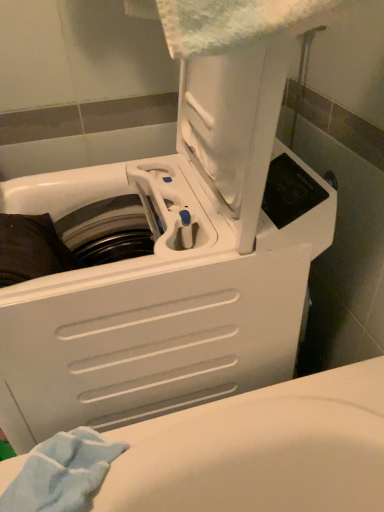
Question: From the image's perspective, is light blue soft towel at lower left located above or below white plastic washing machine at center?

Choices:
 (A) above
 (B) below

Answer: (B)

Question: Is light blue soft towel at lower left bigger or smaller than white plastic washing machine at center?

Choices:
 (A) small
 (B) big

Answer: (A)

Question: Considering the positions of point (54, 476) and point (102, 210), is point (54, 476) closer or farther from the camera than point (102, 210)?

Choices:
 (A) farther
 (B) closer

Answer: (B)

Question: Looking at their shapes, would you say white plastic washing machine at center is wider or thinner than light blue soft towel at lower left?

Choices:
 (A) wide
 (B) thin

Answer: (A)

Question: In the image, is white plastic washing machine at center positioned in front of or behind light blue soft towel at lower left?

Choices:
 (A) front
 (B) behind

Answer: (A)

Question: From a real-world perspective, is white plastic washing machine at center positioned above or below light blue soft towel at lower left?

Choices:
 (A) below
 (B) above

Answer: (B)

Question: Based on their sizes in the image, would you say white plastic washing machine at center is bigger or smaller than light blue soft towel at lower left?

Choices:
 (A) big
 (B) small

Answer: (A)